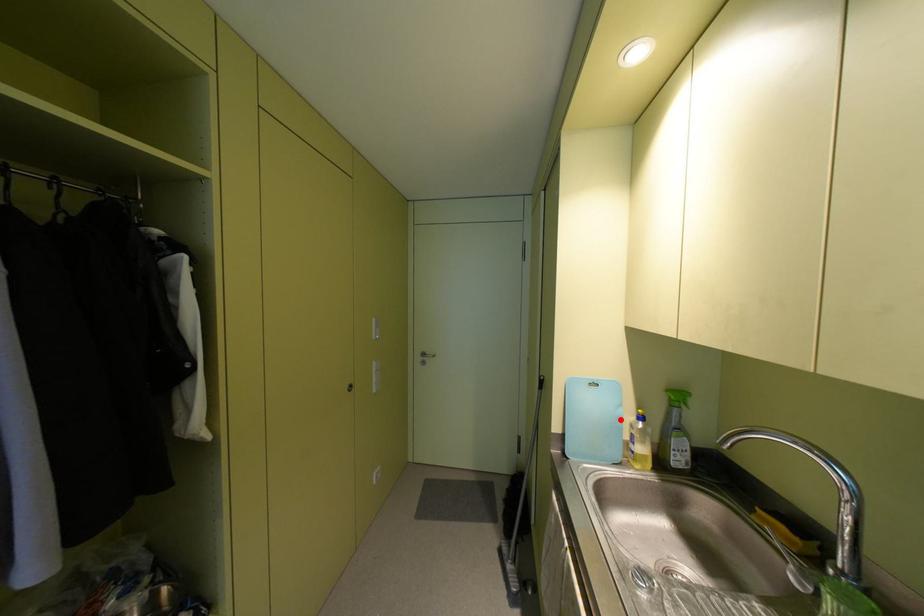
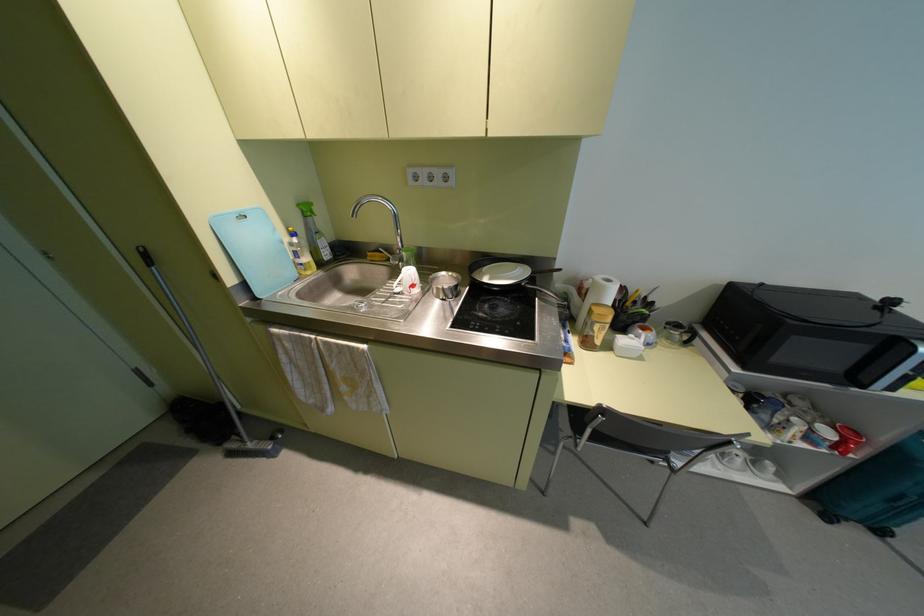
Where in the second image is the point corresponding to the highlighted location from the first image?

(282, 241)